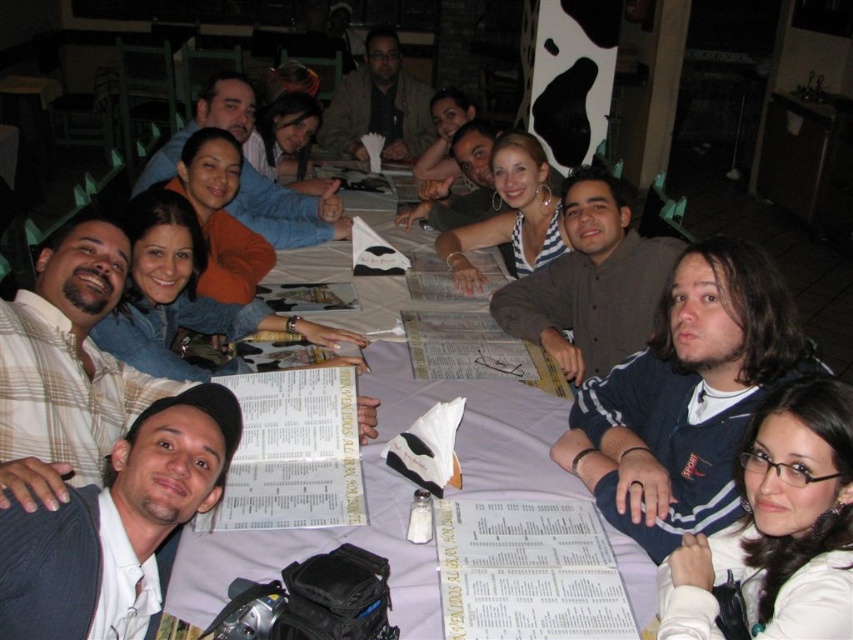
You are a photographer setting up for a group photo. You notice the white paper table at center and the matte black hair at center. Which object is lower in height?

The white paper table at center has a lesser height compared to matte black hair at center, so the white paper table at center is lower.